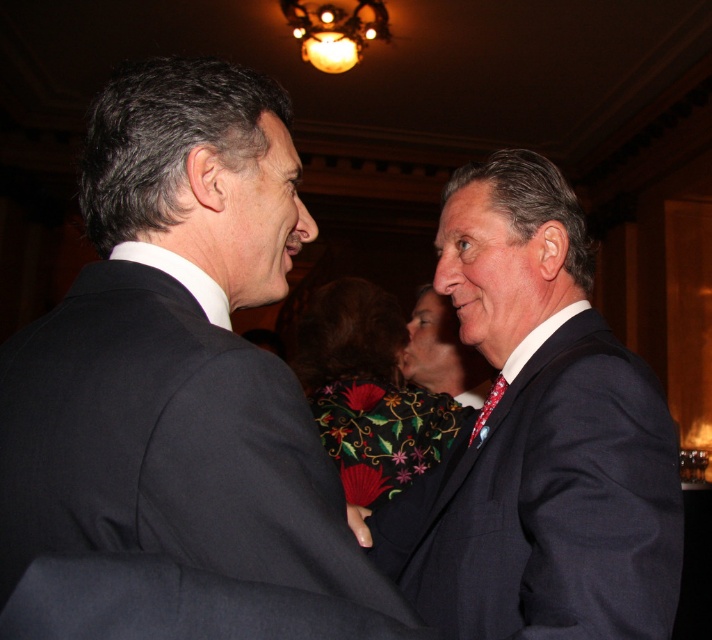
Which is more to the right, dark blue suit at right or patterned silk tie at right?

From the viewer's perspective, patterned silk tie at right appears more on the right side.

What do you see at coordinates (538, 436) in the screenshot? I see `dark blue suit at right` at bounding box center [538, 436].

Find the location of `dark blue suit at right`. dark blue suit at right is located at coordinates (538, 436).

Who is higher up, dark blue suit at right or embroidered silk vest at center?

dark blue suit at right is higher up.

Where is `dark blue suit at right`? dark blue suit at right is located at coordinates (538, 436).

Which is more to the left, black matte suit at center or matte black suit at center?

Positioned to the left is black matte suit at center.

Is black matte suit at center closer to the viewer compared to matte black suit at center?

Yes, black matte suit at center is closer to the viewer.

At what (x,y) coordinates should I click in order to perform the action: click on black matte suit at center. Please return your answer as a coordinate pair (x, y). This screenshot has height=640, width=712. Looking at the image, I should click on (178, 355).

Image resolution: width=712 pixels, height=640 pixels. Find the location of `black matte suit at center`. black matte suit at center is located at coordinates (178, 355).